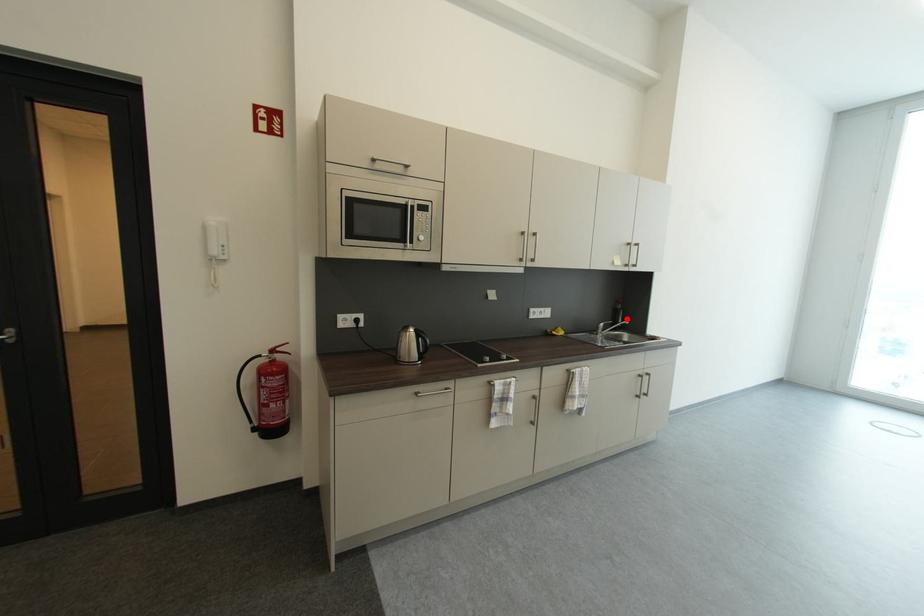
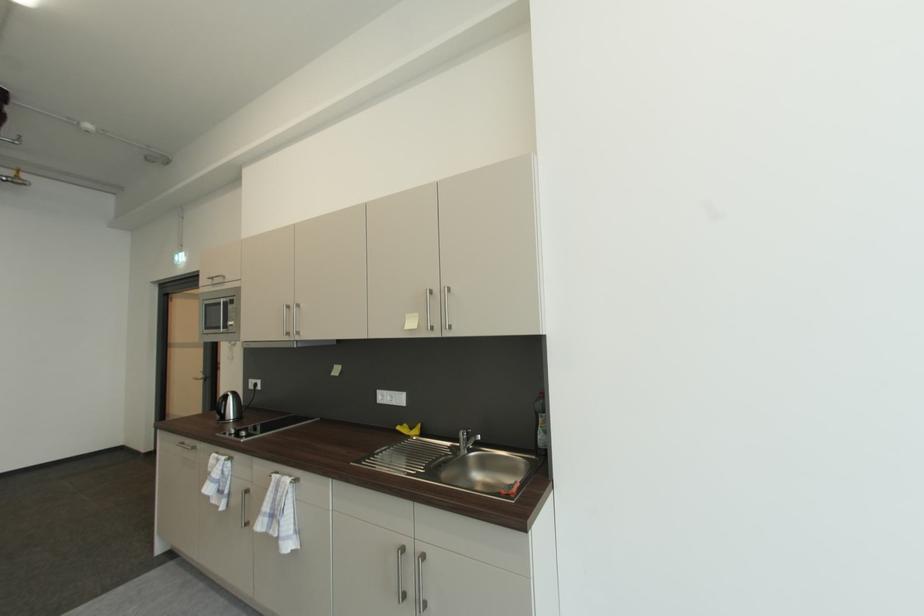
Question: I am providing you with two images of the same scene from different viewpoints. A red point is shown in image1. For the corresponding object point in image2, is it positioned nearer or farther from the camera?

Choices:
 (A) Nearer
 (B) Farther

Answer: (B)